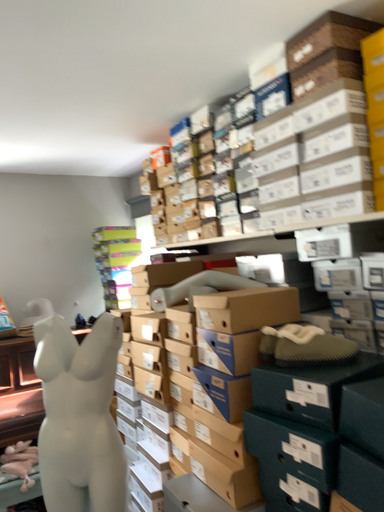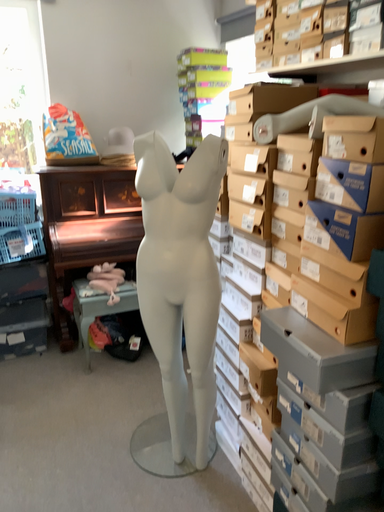
Question: How did the camera likely rotate when shooting the video?

Choices:
 (A) rotated upward
 (B) rotated downward

Answer: (B)